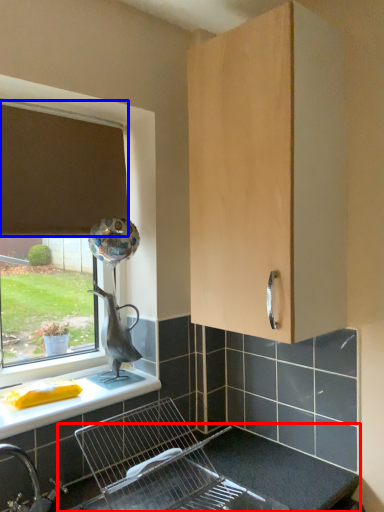
Question: Which object is further to the camera taking this photo, counter top (highlighted by a red box) or curtain (highlighted by a blue box)?

Choices:
 (A) counter top
 (B) curtain

Answer: (B)